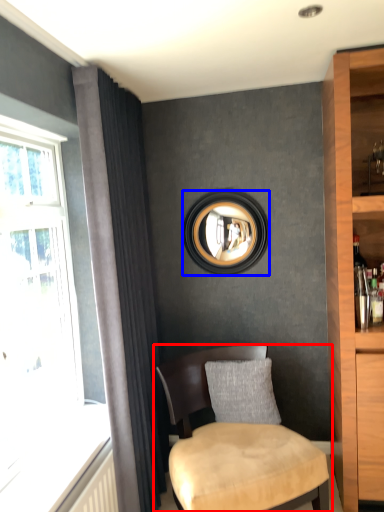
Question: Which of the following is the closest to the observer, chair (highlighted by a red box) or picture frame (highlighted by a blue box)?

Choices:
 (A) chair
 (B) picture frame

Answer: (A)